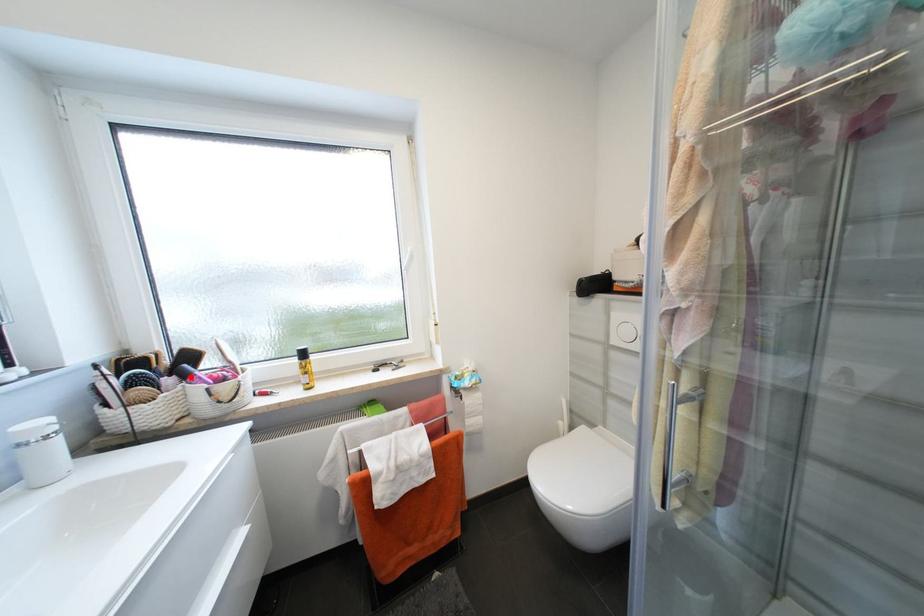
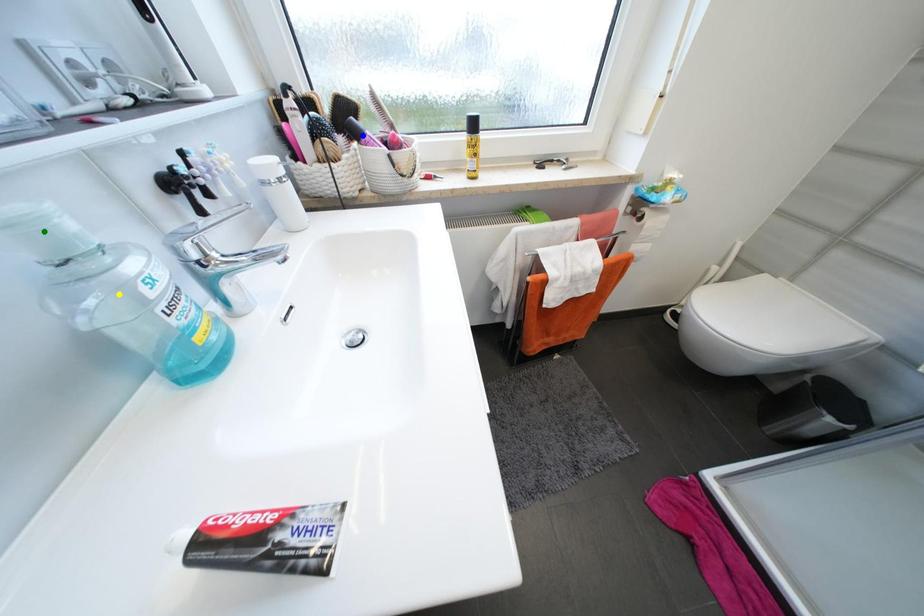
Question: I am providing you with two images of the same scene from different viewpoints. A red point is marked on the first image. You are given multiple points on the second image. Which point in image 2 represents the same 3d spot as the red point in image 1?

Choices:
 (A) green point
 (B) blue point
 (C) yellow point

Answer: (B)